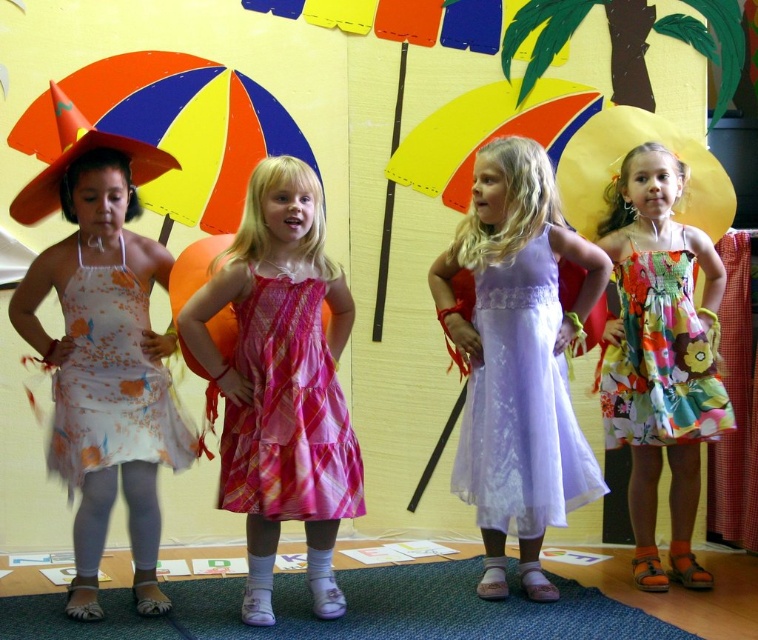
You are a photographer standing in front of the image. You need to capture a photo where both the floral cotton dress at center and the yellow fabric umbrella at center are in focus. Given that your camera can only focus on objects within a 3 feet range, will you be able to achieve this?

The floral cotton dress at center and yellow fabric umbrella at center are 3.71 feet apart from each other. Since the distance between them exceeds the camera focus range of 3 feet, you will not be able to have both in focus simultaneously.

You are a photographer trying to capture a clear shot of the yellow fabric umbrella at center and the floral chiffon dress at left. Since the umbrella is blocking part of the dress, should you move the umbrella down or up to get a better view of the dress?

The yellow fabric umbrella at center is located above the floral chiffon dress at left. To get a better view of the dress, you should move the umbrella up so it no longer blocks the dress.